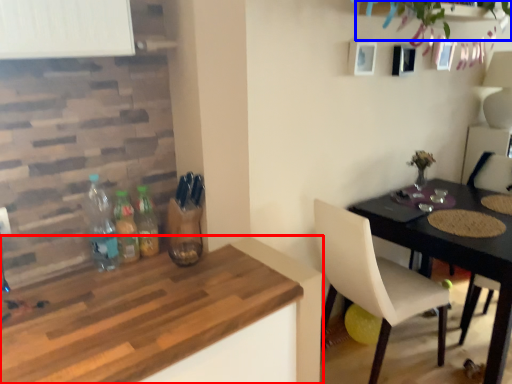
Question: Which object appears farthest to the camera in this image, kitchen & dining room table (highlighted by a red box) or plant (highlighted by a blue box)?

Choices:
 (A) kitchen & dining room table
 (B) plant

Answer: (B)